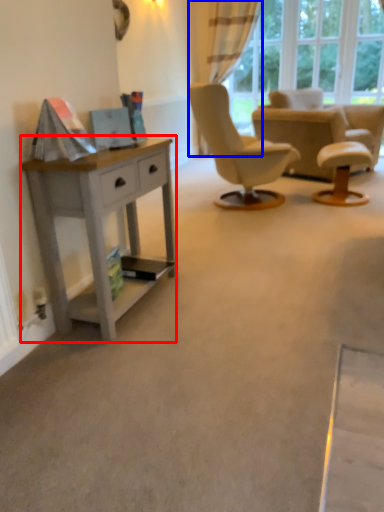
Question: Which point is further to the camera, desk (highlighted by a red box) or curtain (highlighted by a blue box)?

Choices:
 (A) desk
 (B) curtain

Answer: (B)